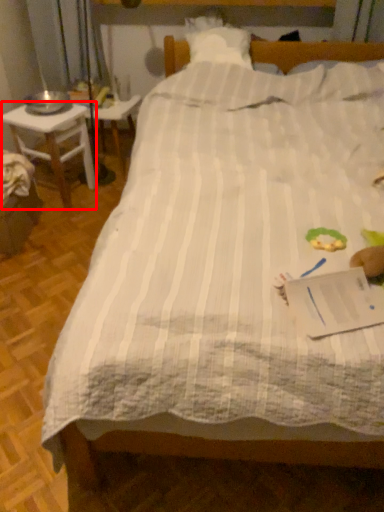
Question: Observing the image, what is the correct spatial positioning of desk (annotated by the red box) in reference to table?

Choices:
 (A) left
 (B) right

Answer: (A)